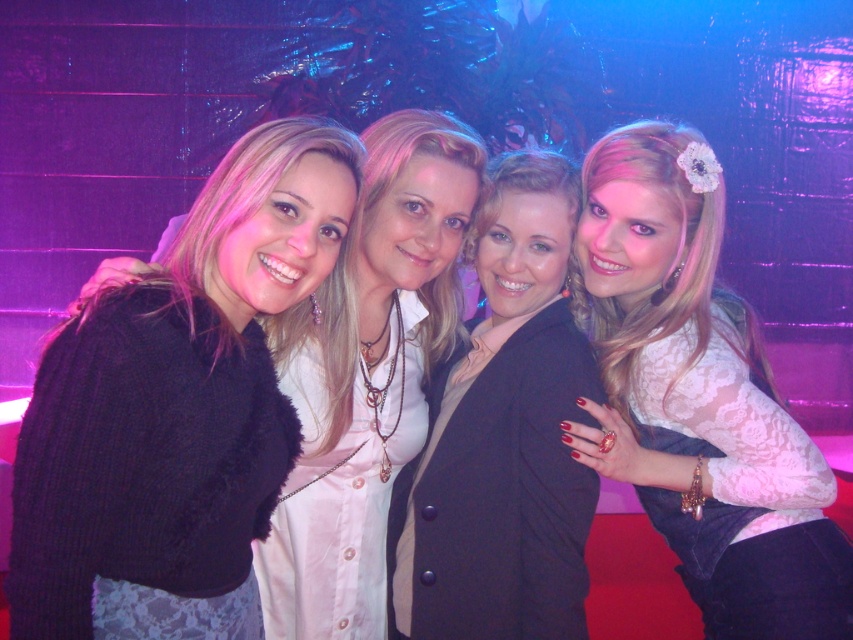
Question: Which point is farther to the camera?

Choices:
 (A) lace fabric at upper right
 (B) matte black blazer at center

Answer: (B)

Question: In this image, where is fuzzy black sweater at left located relative to matte black blazer at center?

Choices:
 (A) right
 (B) left

Answer: (B)

Question: Based on their relative distances, which object is farther from the fuzzy black sweater at left?

Choices:
 (A) lace fabric at upper right
 (B) matte black blazer at center

Answer: (A)

Question: Does fuzzy black sweater at left appear on the left side of matte black blazer at center?

Choices:
 (A) yes
 (B) no

Answer: (A)

Question: Considering the real-world distances, which object is farthest from the lace fabric at upper right?

Choices:
 (A) fuzzy black sweater at left
 (B) matte black blazer at center

Answer: (A)

Question: Is lace fabric at upper right thinner than matte black blazer at center?

Choices:
 (A) no
 (B) yes

Answer: (A)